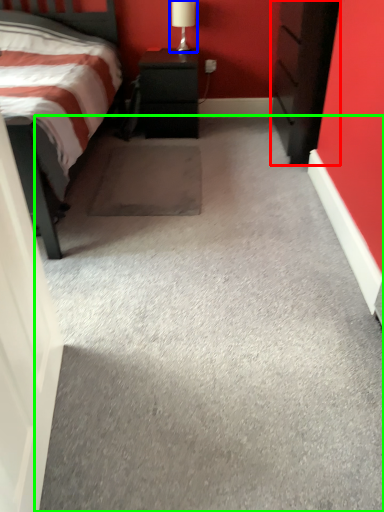
Question: Which object is positioned farthest from chest of drawers (highlighted by a red box)? Select from table lamp (highlighted by a blue box) and concrete (highlighted by a green box).

Choices:
 (A) table lamp
 (B) concrete

Answer: (B)